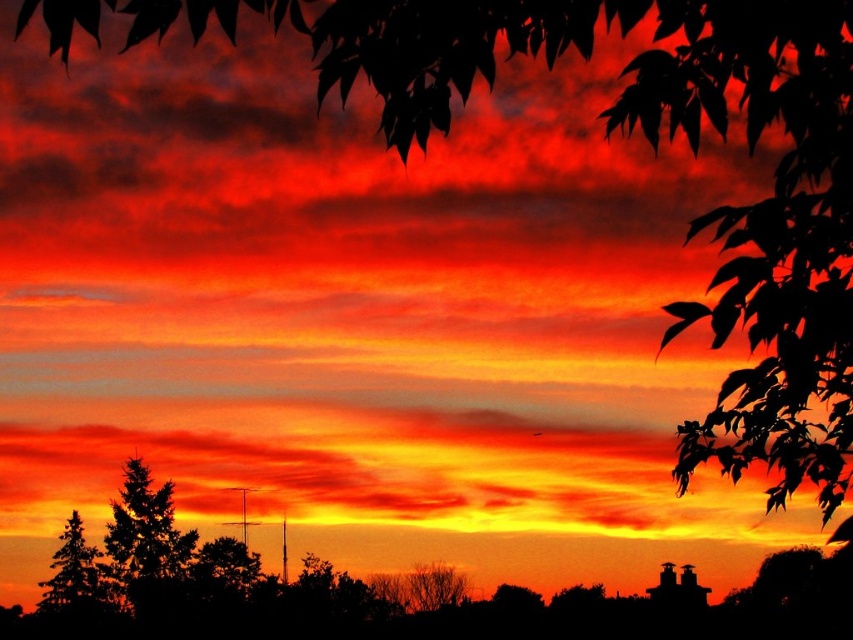
Is silhouette evergreen tree at lower left below bare branches at lower center?

No, silhouette evergreen tree at lower left is not below bare branches at lower center.

Which of these two, silhouette evergreen tree at lower left or bare branches at lower center, stands taller?

bare branches at lower center is taller.

Locate an element on the screen. silhouette evergreen tree at lower left is located at coordinates (74, 576).